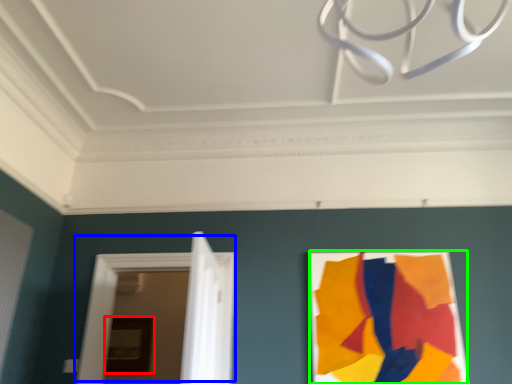
Question: Which is nearer to the picture frame (highlighted by a red box)? door (highlighted by a blue box) or poster (highlighted by a green box).

Choices:
 (A) door
 (B) poster

Answer: (A)